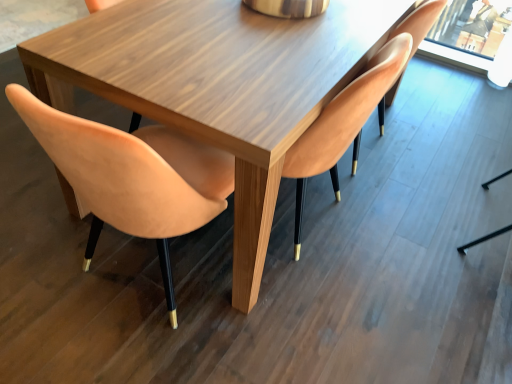
Identify the location of free location to the left of suede-like peach chair at left, which is counted as the first chair, starting from the left. This screenshot has height=384, width=512. (41, 246).